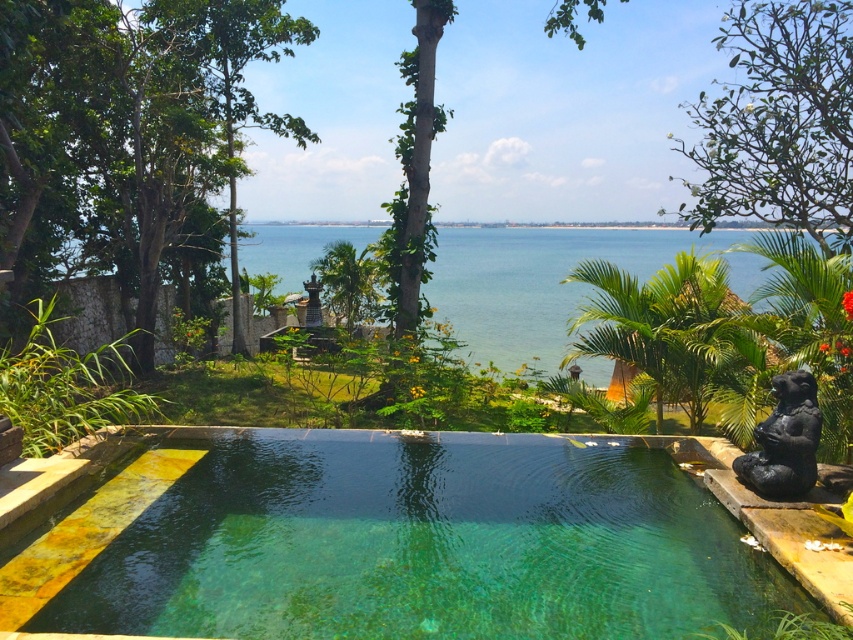
Can you confirm if clear glass pool at center is shorter than black stone statue at right?

Correct, clear glass pool at center is not as tall as black stone statue at right.

Based on the photo, does clear glass pool at center appear on the right side of black stone statue at right?

Incorrect, clear glass pool at center is not on the right side of black stone statue at right.

Is point (468, 576) farther from camera compared to point (792, 388)?

No, it is in front of (792, 388).

Where is `clear glass pool at center`? The image size is (853, 640). clear glass pool at center is located at coordinates (395, 540).

Between clear blue water at center and black stone statue at right, which one is positioned lower?

black stone statue at right is below.

The width and height of the screenshot is (853, 640). In order to click on clear blue water at center in this screenshot , I will do `click(550, 282)`.

Does clear glass pool at center have a greater width compared to clear blue water at center?

In fact, clear glass pool at center might be narrower than clear blue water at center.

Does clear glass pool at center come in front of clear blue water at center?

Yes, clear glass pool at center is closer to the viewer.

Does point (158, 596) lie in front of point (296, 284)?

Yes, point (158, 596) is closer to viewer.

Where is `clear glass pool at center`? clear glass pool at center is located at coordinates (395, 540).